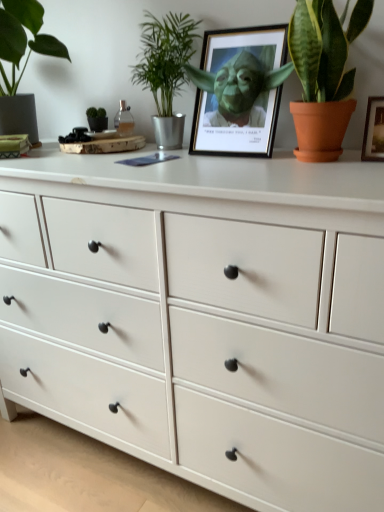
Question: Visually, is green leafy plant at upper center, acting as the 2th houseplant starting from the left, positioned to the left or to the right of matte black picture frame at center?

Choices:
 (A) right
 (B) left

Answer: (B)

Question: Is point (175, 20) closer or farther from the camera than point (248, 65)?

Choices:
 (A) closer
 (B) farther

Answer: (B)

Question: Considering the real-world distances, which object is closest to the matte black picture frame at center?

Choices:
 (A) green leafy plant at upper center, marked as the 2th houseplant in a right-to-left arrangement
 (B) green glossy leafy plant at upper right, the 3th houseplant positioned from the left
 (C) green matte plant at left, positioned as the third houseplant in right-to-left order
 (D) white wood chest of drawers at center

Answer: (B)

Question: Considering the real-world distances, which object is closest to the green glossy leafy plant at upper right, the 3th houseplant positioned from the left?

Choices:
 (A) white wood chest of drawers at center
 (B) green leafy plant at upper center, marked as the 2th houseplant in a right-to-left arrangement
 (C) matte black picture frame at center
 (D) green matte plant at left, the first houseplant from the left

Answer: (C)